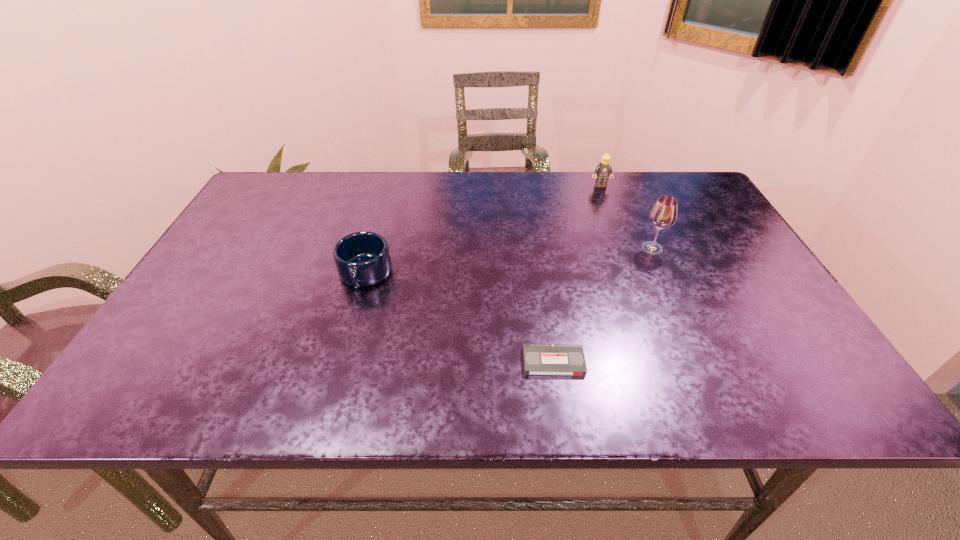
Image resolution: width=960 pixels, height=540 pixels. Find the location of `free space between the second tallest object and the third object from right to left`. free space between the second tallest object and the third object from right to left is located at coordinates (577, 274).

The image size is (960, 540). Identify the location of free space that is in between the leftmost object and the farthest object. (483, 230).

Where is `empty space that is in between the wineglass and the nearest object`? empty space that is in between the wineglass and the nearest object is located at coordinates (603, 305).

You are a GUI agent. You are given a task and a screenshot of the screen. Output one action in this format:
    pyautogui.click(x=<x>, y=<y>)
    Task: Click on the vacant area between the mug and the Lego
    This screenshot has height=540, width=960.
    Given the screenshot: What is the action you would take?
    [x=483, y=230]

Locate an element on the screen. This screenshot has height=540, width=960. vacant region between the mug and the farthest object is located at coordinates (483, 230).

Locate an element on the screen. empty space that is in between the mug and the rightmost object is located at coordinates (509, 261).

The width and height of the screenshot is (960, 540). Identify the location of empty space that is in between the mug and the Lego. (483, 230).

The width and height of the screenshot is (960, 540). In order to click on vacant area that lies between the second object from right to left and the mug in this screenshot , I will do `click(483, 230)`.

I want to click on vacant space that is in between the third object from left to right and the rightmost object, so click(626, 217).

Find the location of `empty location between the Lego and the tallest object`. empty location between the Lego and the tallest object is located at coordinates (626, 217).